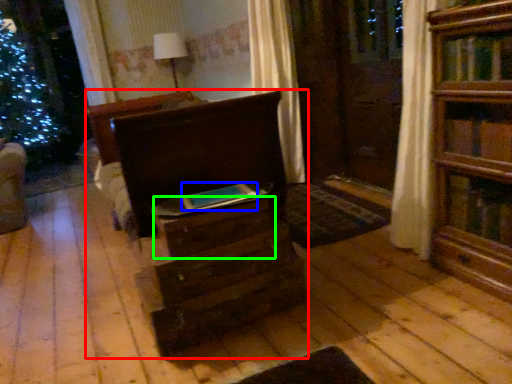
Question: Considering the real-world distances, which object is farthest from chest of drawers (highlighted by a red box)? book (highlighted by a blue box) or drawer (highlighted by a green box)?

Choices:
 (A) book
 (B) drawer

Answer: (A)